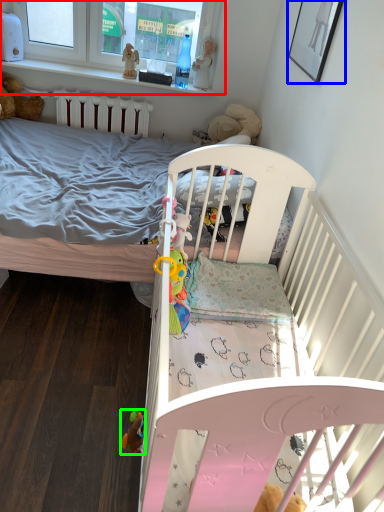
Question: Based on their relative distances, which object is nearer to window frame (highlighted by a red box)? Choose from picture frame (highlighted by a blue box) and toy (highlighted by a green box).

Choices:
 (A) picture frame
 (B) toy

Answer: (A)